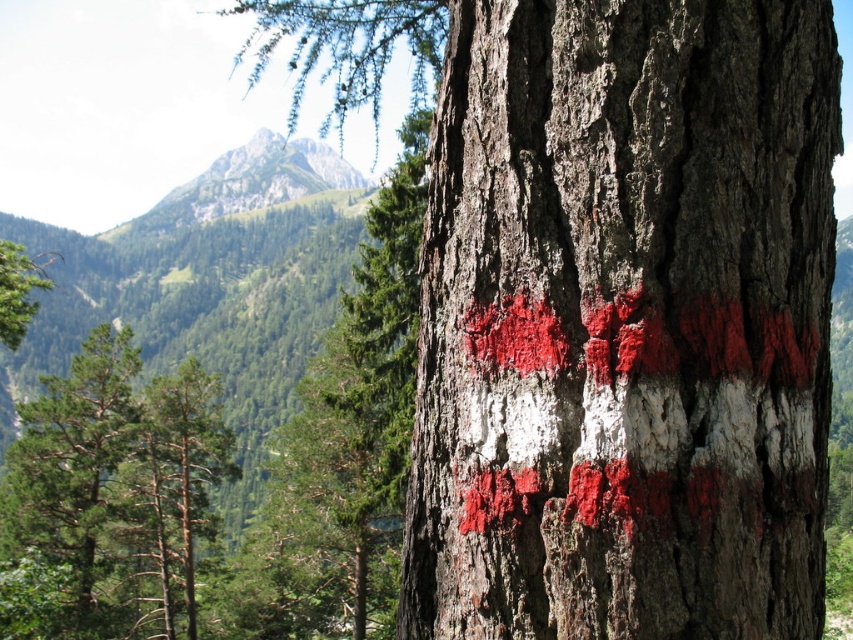
You are standing in front of the tree trunk marked with red and white paint. There are two points on the trunk at coordinates point (616, 461) and point (131, 330). Which point is closer to you?

Point (616, 461) is in front of point (131, 330), so it is closer to you.

You are standing in a forest and see the smooth bark tree trunk at center and the green rough bark tree at left. Which tree trunk is closer to you?

The smooth bark tree trunk at center is closer to you because it is in front of the green rough bark tree at left.

You are standing in front of the green rough bark tree at left. Based on its position in the scene, can you determine if it is closer to you or further away compared to the other elements in the background?

The green rough bark tree at left is located at point (x=67, y=493), which places it closer to the foreground compared to the background elements, so it is closer to you.